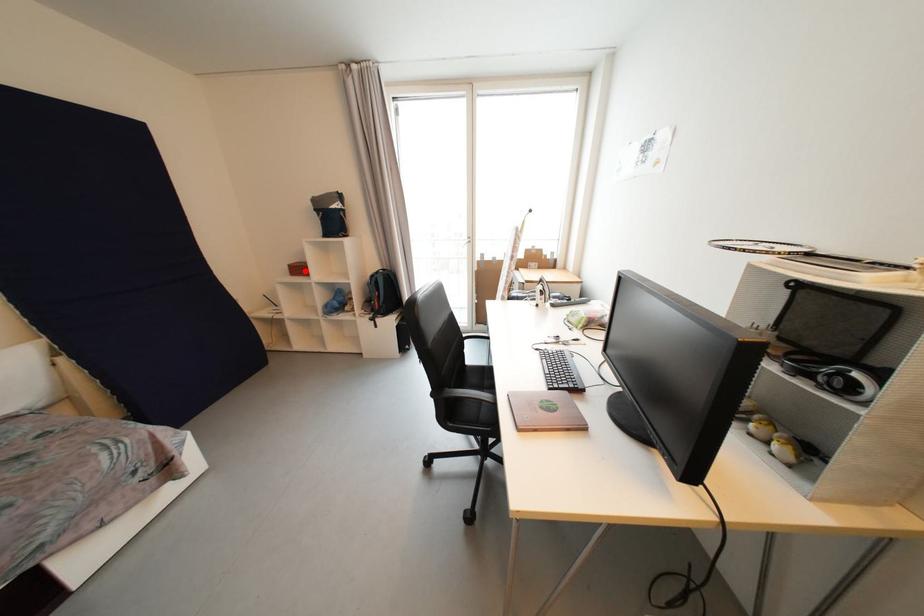
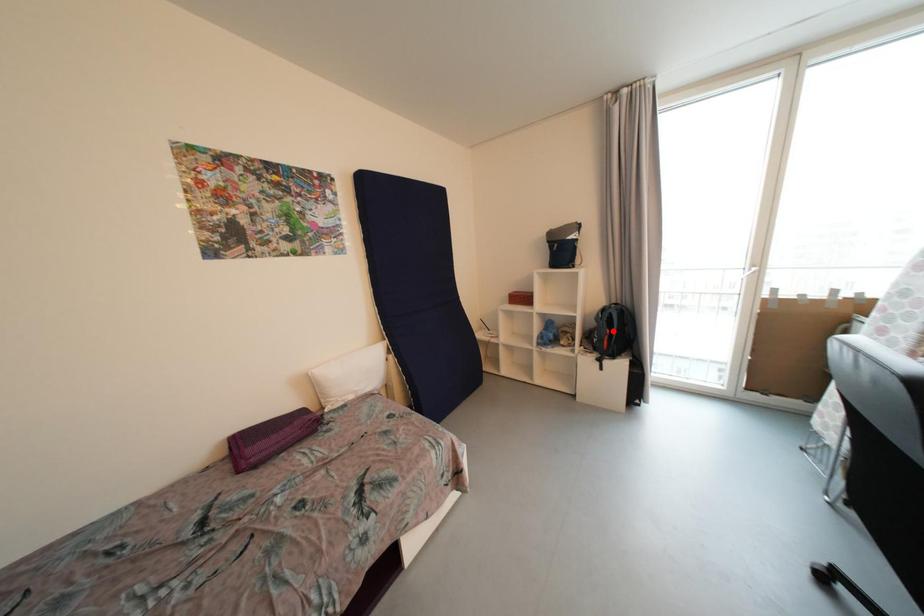
I am providing you with two images of the same scene from different viewpoints. A red point is marked on the first image and another point is marked on the second image. Do the highlighted points in image1 and image2 indicate the same real-world spot?

No